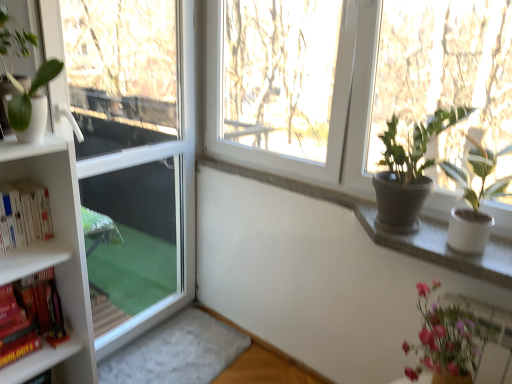
Question: Can you confirm if pink glossy vase at lower right, the 3th houseplant when ordered from left to right, is positioned to the left of matte gray pot at upper right, placed as the second houseplant when sorted from right to left?

Choices:
 (A) no
 (B) yes

Answer: (A)

Question: From a real-world perspective, is pink glossy vase at lower right, acting as the first houseplant starting from the right, below matte gray pot at upper right, marked as the 2th houseplant in a left-to-right arrangement?

Choices:
 (A) no
 (B) yes

Answer: (B)

Question: Considering the relative sizes of pink glossy vase at lower right, acting as the first houseplant starting from the right, and matte gray pot at upper right, marked as the 2th houseplant in a left-to-right arrangement, in the image provided, is pink glossy vase at lower right, acting as the first houseplant starting from the right, thinner than matte gray pot at upper right, marked as the 2th houseplant in a left-to-right arrangement,?

Choices:
 (A) no
 (B) yes

Answer: (A)

Question: Is pink glossy vase at lower right, which is counted as the first houseplant, starting from the bottom, closer to the viewer compared to matte gray pot at upper right, the 2th houseplant in the top-to-bottom sequence?

Choices:
 (A) no
 (B) yes

Answer: (B)

Question: Is pink glossy vase at lower right, which is counted as the first houseplant, starting from the bottom, oriented towards matte gray pot at upper right, the 2th houseplant in the top-to-bottom sequence?

Choices:
 (A) yes
 (B) no

Answer: (B)

Question: Would you say hardcover books at left, the first book ordered from the bottom, is inside or outside hardcover books at left, which is the 2th book in bottom-to-top order?

Choices:
 (A) outside
 (B) inside

Answer: (A)

Question: Considering the positions of hardcover books at left, the second book from the top, and hardcover books at left, placed as the 1th book when sorted from top to bottom, in the image, is hardcover books at left, the second book from the top, taller or shorter than hardcover books at left, placed as the 1th book when sorted from top to bottom,?

Choices:
 (A) short
 (B) tall

Answer: (B)

Question: From a real-world perspective, is hardcover books at left, the first book ordered from the bottom, physically located above or below hardcover books at left, which is the 2th book in bottom-to-top order?

Choices:
 (A) below
 (B) above

Answer: (A)

Question: Based on their sizes in the image, would you say hardcover books at left, the first book ordered from the bottom, is bigger or smaller than hardcover books at left, placed as the 1th book when sorted from top to bottom?

Choices:
 (A) big
 (B) small

Answer: (A)

Question: Does point (41, 309) appear closer or farther from the camera than point (12, 29)?

Choices:
 (A) closer
 (B) farther

Answer: (B)

Question: From their relative heights in the image, would you say hardcover books at left, the second book from the top, is taller or shorter than matte white pot at left, placed as the third houseplant when sorted from right to left?

Choices:
 (A) tall
 (B) short

Answer: (B)

Question: Is hardcover books at left, the second book from the top, situated inside matte white pot at left, acting as the 1th houseplant starting from the left, or outside?

Choices:
 (A) inside
 (B) outside

Answer: (B)

Question: From the image's perspective, relative to matte white pot at left, which is the third houseplant in bottom-to-top order, is hardcover books at left, the second book from the top, above or below?

Choices:
 (A) below
 (B) above

Answer: (A)

Question: Looking at their shapes, would you say hardcover books at left, the second book from the top, is wider or thinner than white ceramic pot at upper right?

Choices:
 (A) thin
 (B) wide

Answer: (A)

Question: In terms of size, does hardcover books at left, the second book from the top, appear bigger or smaller than white ceramic pot at upper right?

Choices:
 (A) big
 (B) small

Answer: (A)